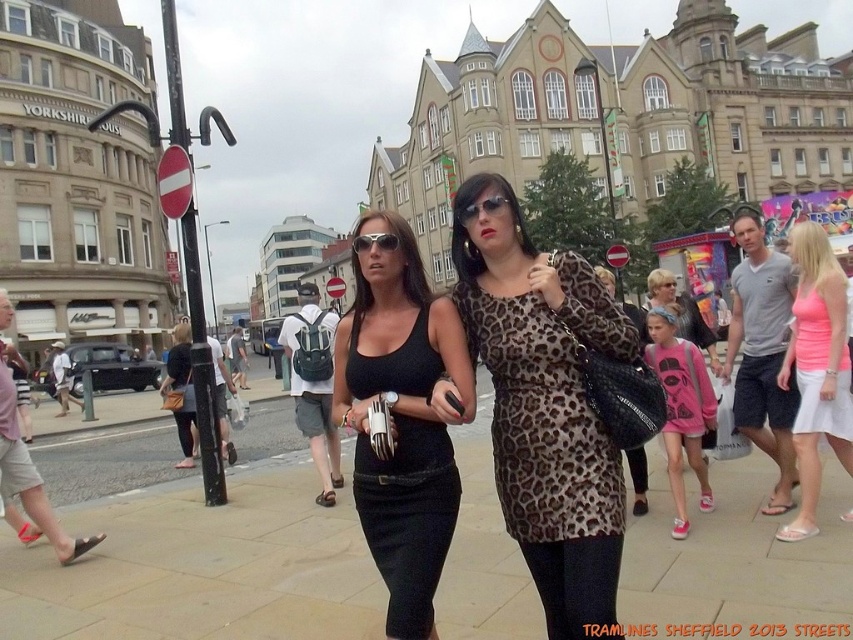
Is smooth concrete sidewalk at center taller than black matte dress at center?

No, smooth concrete sidewalk at center is not taller than black matte dress at center.

Between point (126, 497) and point (428, 332), which one is positioned behind?

The point (126, 497) is behind.

Locate an element on the screen. The height and width of the screenshot is (640, 853). smooth concrete sidewalk at center is located at coordinates (202, 566).

Does smooth concrete sidewalk at center appear under leopard print dress at center?

Correct, smooth concrete sidewalk at center is located below leopard print dress at center.

At what (x,y) coordinates should I click in order to perform the action: click on smooth concrete sidewalk at center. Please return your answer as a coordinate pair (x, y). The width and height of the screenshot is (853, 640). Looking at the image, I should click on (202, 566).

Does smooth concrete sidewalk at center appear under sunglasses at center?

Correct, smooth concrete sidewalk at center is located below sunglasses at center.

Can you confirm if smooth concrete sidewalk at center is taller than sunglasses at center?

Yes, smooth concrete sidewalk at center is taller than sunglasses at center.

Does point (833, 564) come in front of point (351, 244)?

That is True.

Where is `smooth concrete sidewalk at center`? smooth concrete sidewalk at center is located at coordinates (202, 566).